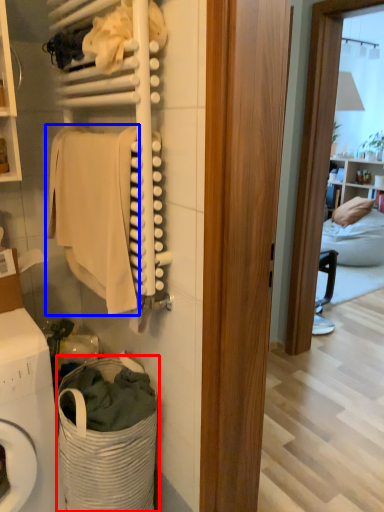
Question: Which of the following is the closest to the observer, laundry basket (highlighted by a red box) or clothing (highlighted by a blue box)?

Choices:
 (A) laundry basket
 (B) clothing

Answer: (B)